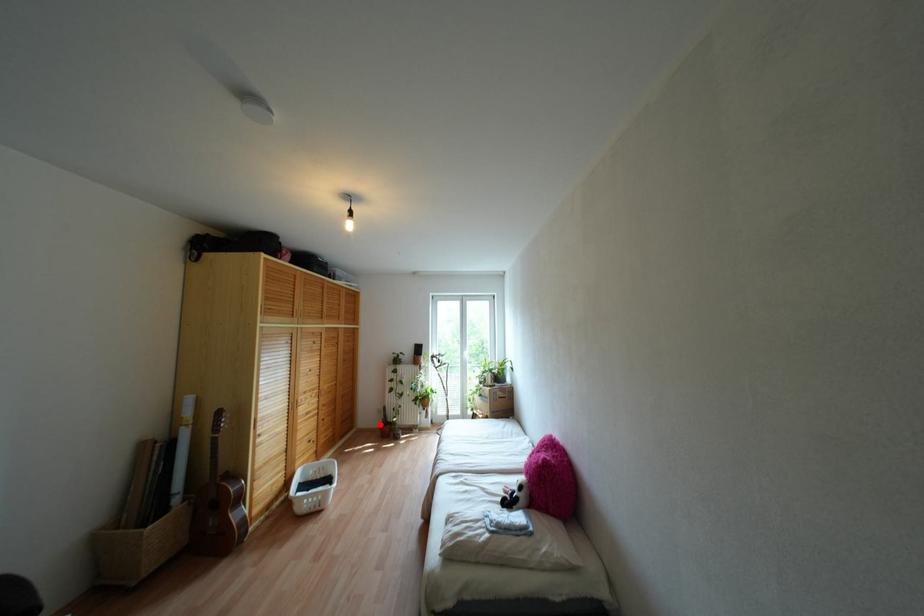
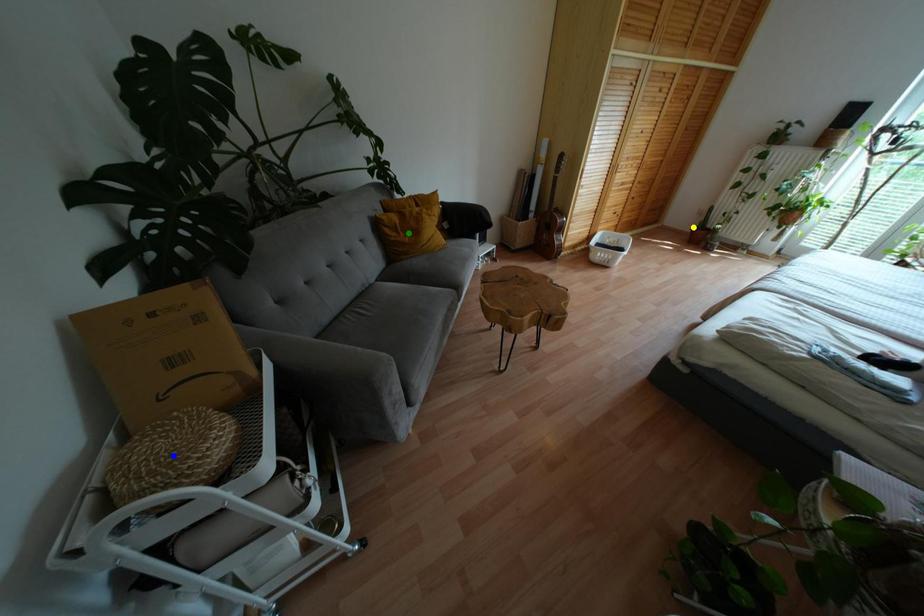
Question: I am providing you with two images of the same scene from different viewpoints. A red point is marked on the first image. You are given multiple points on the second image. Can you choose the point in image 2 that corresponds to the point in image 1?

Choices:
 (A) green point
 (B) blue point
 (C) yellow point

Answer: (C)